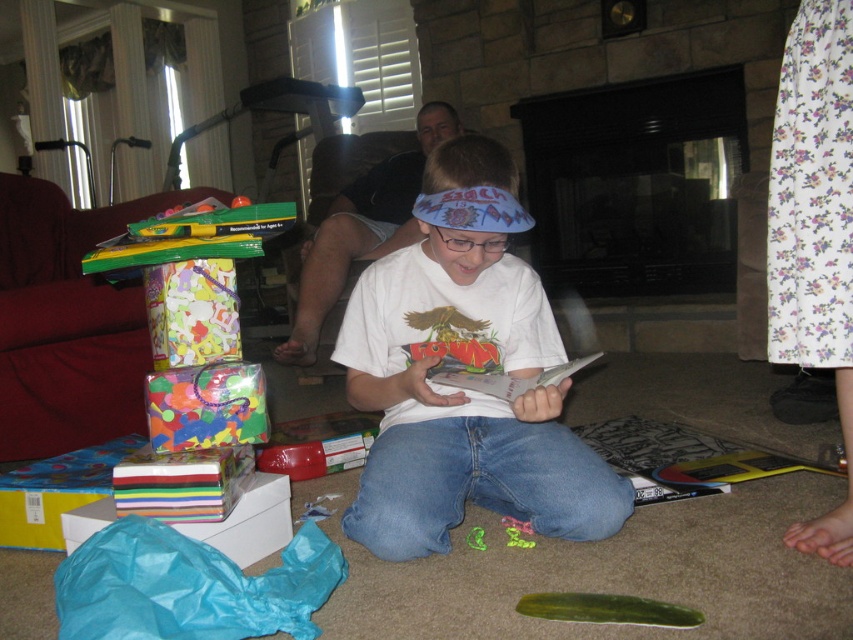
You are standing in the living room and want to place a small decoration at the point labeled as point (548, 618). If your arm reaches out 1.5 meters, can you comfortably reach that point without moving your feet?

The distance of point (548, 618) from the viewer is 1.22 meters. Since your arm can reach out 1.5 meters, you can comfortably reach the point without moving your feet.